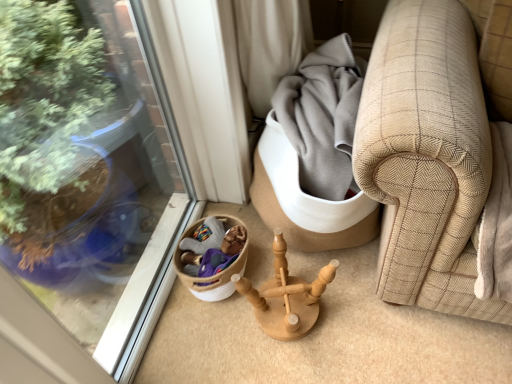
Question: From a real-world perspective, relative to natural wood candlestick holder at center, is woven beige basket at lower left vertically above or below?

Choices:
 (A) below
 (B) above

Answer: (A)

Question: Which is correct: woven beige basket at lower left is inside natural wood candlestick holder at center, or outside of it?

Choices:
 (A) outside
 (B) inside

Answer: (A)

Question: In the image, is woven beige basket at lower left positioned in front of or behind natural wood candlestick holder at center?

Choices:
 (A) behind
 (B) front

Answer: (A)

Question: From their relative heights in the image, would you say natural wood candlestick holder at center is taller or shorter than woven beige basket at lower left?

Choices:
 (A) tall
 (B) short

Answer: (A)

Question: Considering the relative positions of natural wood candlestick holder at center and woven beige basket at lower left in the image provided, is natural wood candlestick holder at center to the left or to the right of woven beige basket at lower left?

Choices:
 (A) left
 (B) right

Answer: (B)

Question: Is point (266, 302) positioned closer to the camera than point (179, 269)?

Choices:
 (A) farther
 (B) closer

Answer: (B)

Question: Is natural wood candlestick holder at center bigger or smaller than woven beige basket at lower left?

Choices:
 (A) small
 (B) big

Answer: (B)